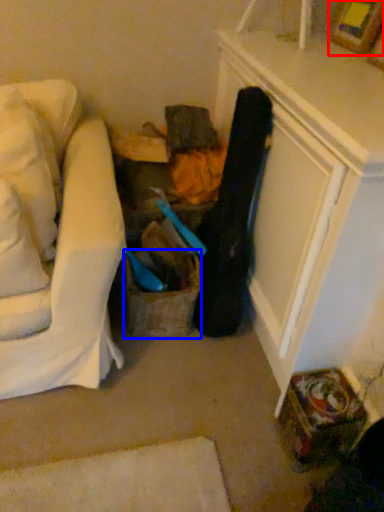
Question: Among these objects, which one is nearest to the camera, picture frame (highlighted by a red box) or basket (highlighted by a blue box)?

Choices:
 (A) picture frame
 (B) basket

Answer: (A)